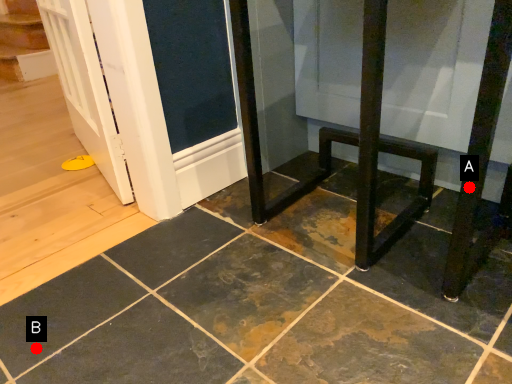
Question: Two points are circled on the image, labeled by A and B beside each circle. Which point is closer to the camera taking this photo?

Choices:
 (A) A is closer
 (B) B is closer

Answer: (A)